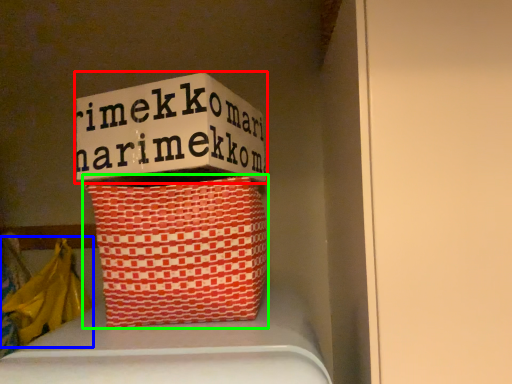
Question: Considering the real-world distances, which object is closest to box (highlighted by a red box)? material (highlighted by a blue box) or basket (highlighted by a green box).

Choices:
 (A) material
 (B) basket

Answer: (B)